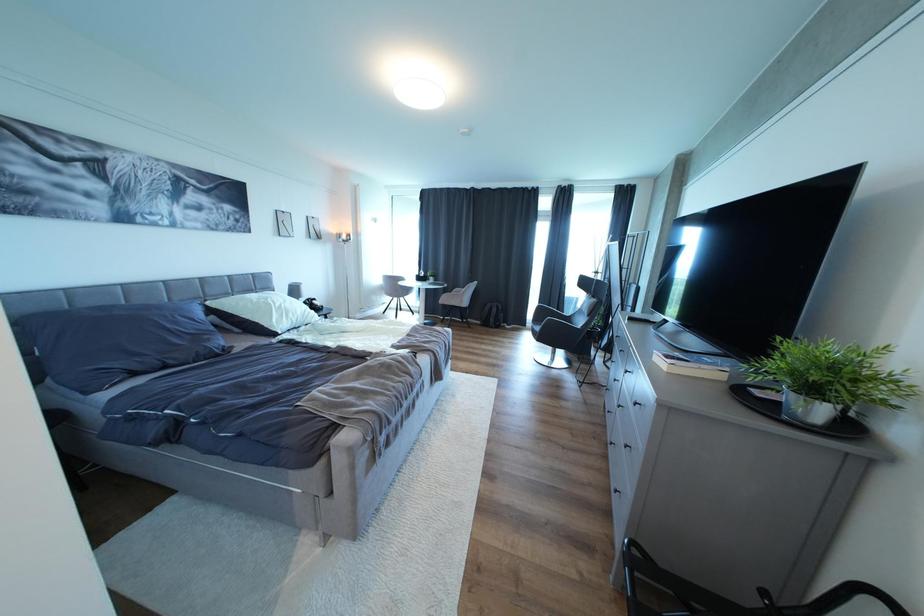
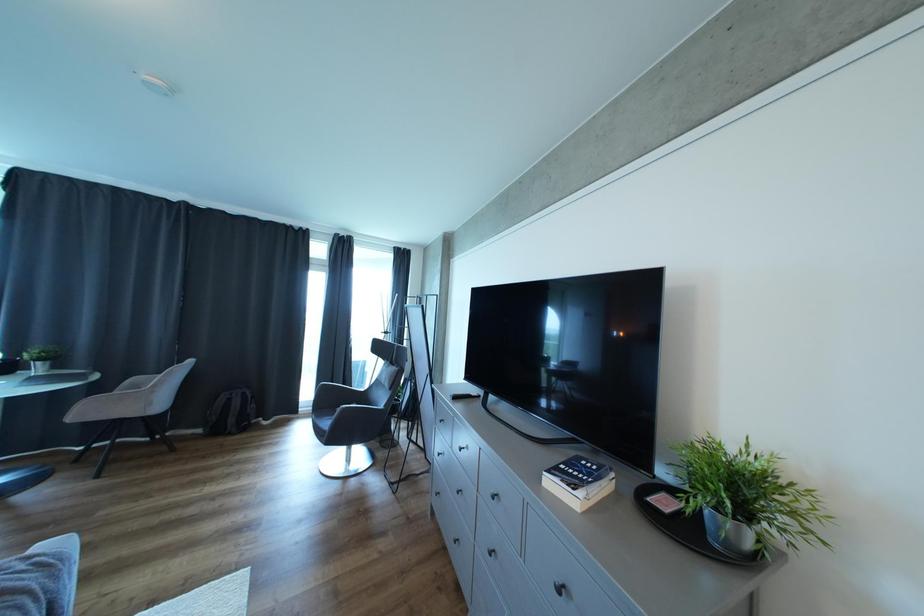
Question: The images are taken continuously from a first-person perspective. In which direction is your viewpoint rotating?

Choices:
 (A) Left
 (B) Right
 (C) Up
 (D) Down

Answer: (B)